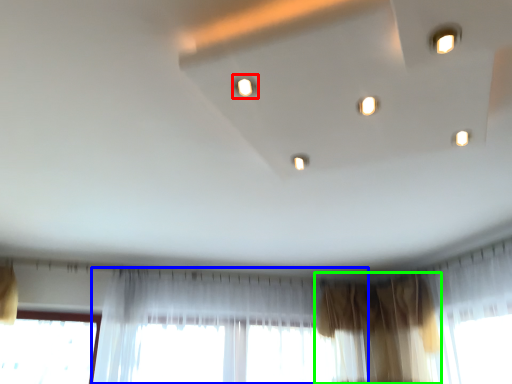
Question: Which object is positioned closest to light (highlighted by a red box)? Select from curtain (highlighted by a blue box) and curtain (highlighted by a green box).

Choices:
 (A) curtain
 (B) curtain

Answer: (A)